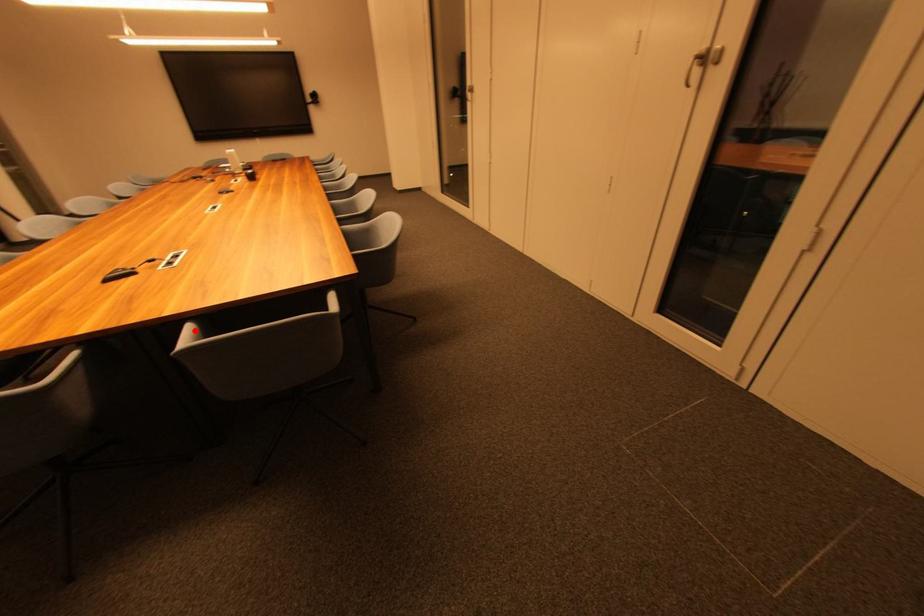
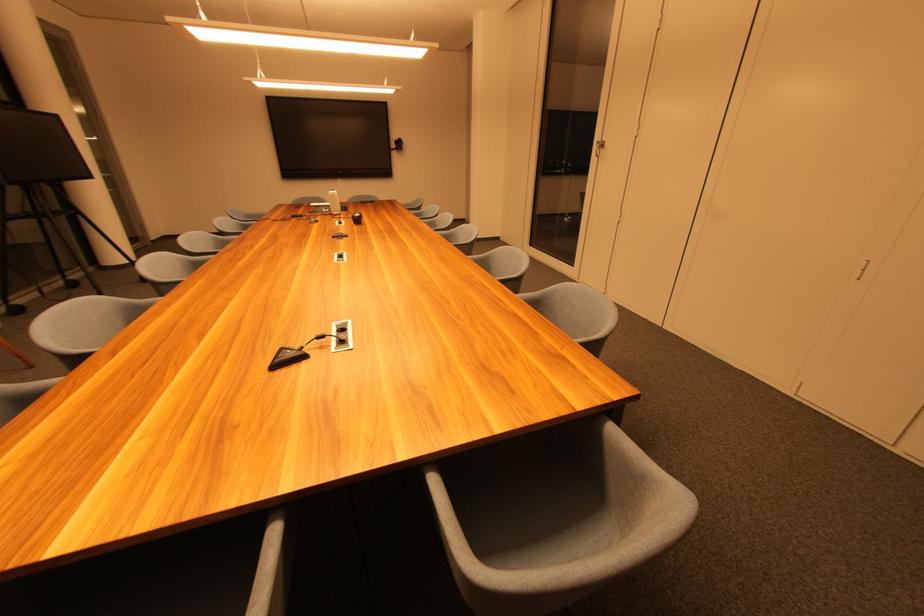
Locate, in the second image, the point that corresponds to the highlighted location in the first image.

(440, 485)